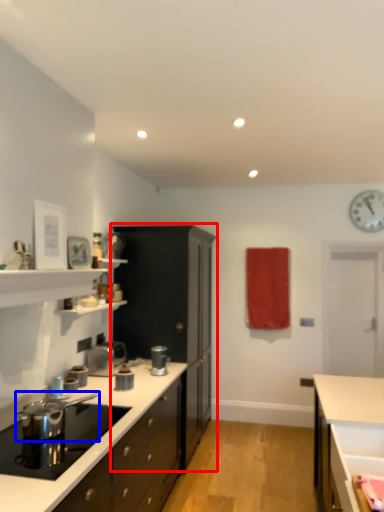
Question: Which object appears farthest to the camera in this image, cabinetry (highlighted by a red box) or appliance (highlighted by a blue box)?

Choices:
 (A) cabinetry
 (B) appliance

Answer: (A)